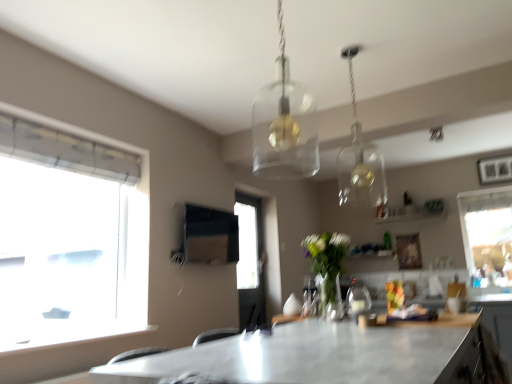
Question: Should I look upward or downward to see clear glass pendant light at upper center, which appears as the 1th lamp when viewed from the right?

Choices:
 (A) up
 (B) down

Answer: (A)

Question: Does clear glass vase at center appear on the right side of transparent glass pendant light at center, which ranks as the 2th lamp in back-to-front order?

Choices:
 (A) yes
 (B) no

Answer: (A)

Question: Is clear glass vase at center oriented towards transparent glass pendant light at center, the first lamp viewed from the front?

Choices:
 (A) no
 (B) yes

Answer: (A)

Question: Is clear glass vase at center at the left side of transparent glass pendant light at center, the second lamp in the right-to-left sequence?

Choices:
 (A) yes
 (B) no

Answer: (B)

Question: From the image's perspective, does clear glass vase at center appear lower than transparent glass pendant light at center, which ranks as the 2th lamp in back-to-front order?

Choices:
 (A) no
 (B) yes

Answer: (B)

Question: Does clear glass vase at center have a lesser height compared to transparent glass pendant light at center, which ranks as the 2th lamp in back-to-front order?

Choices:
 (A) yes
 (B) no

Answer: (A)

Question: Is transparent glass pendant light at center, the second lamp in the right-to-left sequence, completely or partially inside clear glass vase at center?

Choices:
 (A) no
 (B) yes

Answer: (A)

Question: Is transparent glass pendant light at center, the first lamp viewed from the front, not close to clear glass vase at center?

Choices:
 (A) no
 (B) yes

Answer: (A)

Question: From the image's perspective, would you say transparent glass pendant light at center, which is counted as the first lamp, starting from the left, is shown under clear glass vase at center?

Choices:
 (A) no
 (B) yes

Answer: (A)

Question: Are transparent glass pendant light at center, the first lamp viewed from the front, and clear glass vase at center beside each other?

Choices:
 (A) no
 (B) yes

Answer: (A)

Question: Does transparent glass pendant light at center, the first lamp viewed from the front, have a greater width compared to clear glass vase at center?

Choices:
 (A) yes
 (B) no

Answer: (B)

Question: Can you confirm if transparent glass pendant light at center, the second lamp in the right-to-left sequence, is thinner than clear glass vase at center?

Choices:
 (A) no
 (B) yes

Answer: (B)

Question: Is the position of transparent glass pendant light at center, which ranks as the 2th lamp in back-to-front order, less distant than that of clear glass vase at center?

Choices:
 (A) yes
 (B) no

Answer: (A)

Question: Are transparent glass window at right and clear glass vase at center far apart?

Choices:
 (A) yes
 (B) no

Answer: (A)